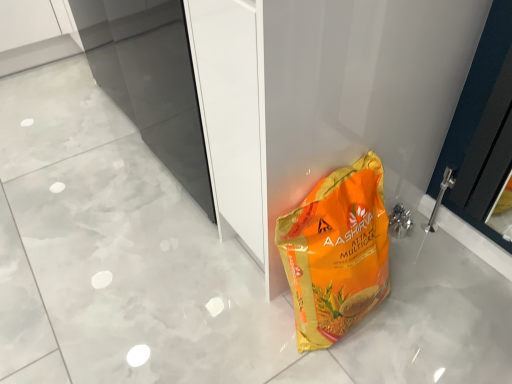
Describe the element at coordinates (336, 252) in the screenshot. This screenshot has height=384, width=512. I see `orange matte plastic bag at lower right` at that location.

The height and width of the screenshot is (384, 512). Find the location of `orange matte plastic bag at lower right`. orange matte plastic bag at lower right is located at coordinates (336, 252).

Measure the distance between point (316, 257) and camera.

38.86 inches.

Find the location of a particular element. The image size is (512, 384). orange matte plastic bag at lower right is located at coordinates (336, 252).